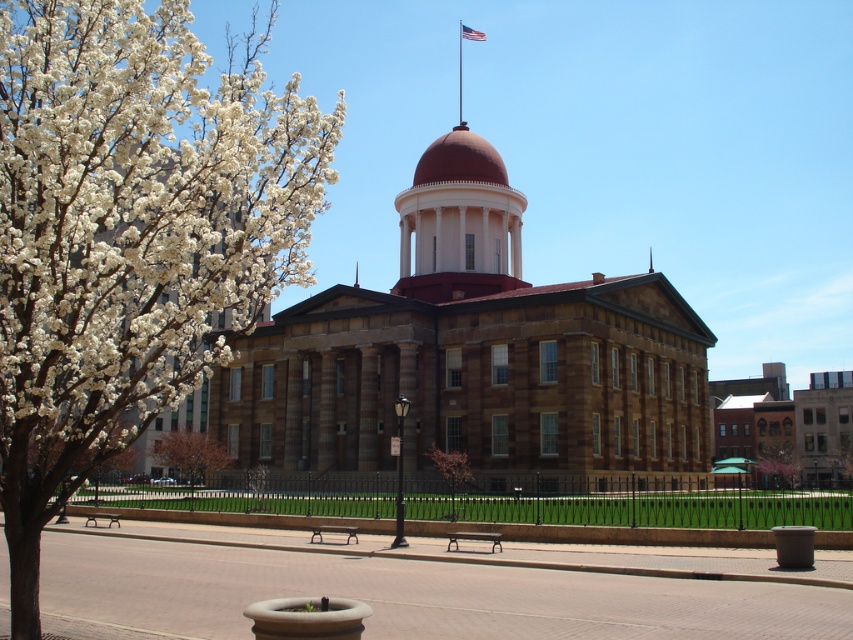
You are standing in front of the historic building and want to take a photo of the matte brick dome at center. If your camera can focus on objects up to 100 meters away, will it be able to capture the dome clearly?

The matte brick dome at center is 92.83 meters away from the viewer. Since the camera can focus up to 100 meters, it will be able to capture the dome clearly as the distance is within the camera range.

You are a photographer planning to capture the grandeur of the historic building. You notice the matte brick dome at center and the bare branches at center in your viewfinder. Which object should you focus on to emphasize the building structure while maintaining balance in the composition?

The matte brick dome at center has a larger size compared to the bare branches at center, so focusing on the matte brick dome at center would emphasize the building structure while maintaining balance in the composition due to its prominence.